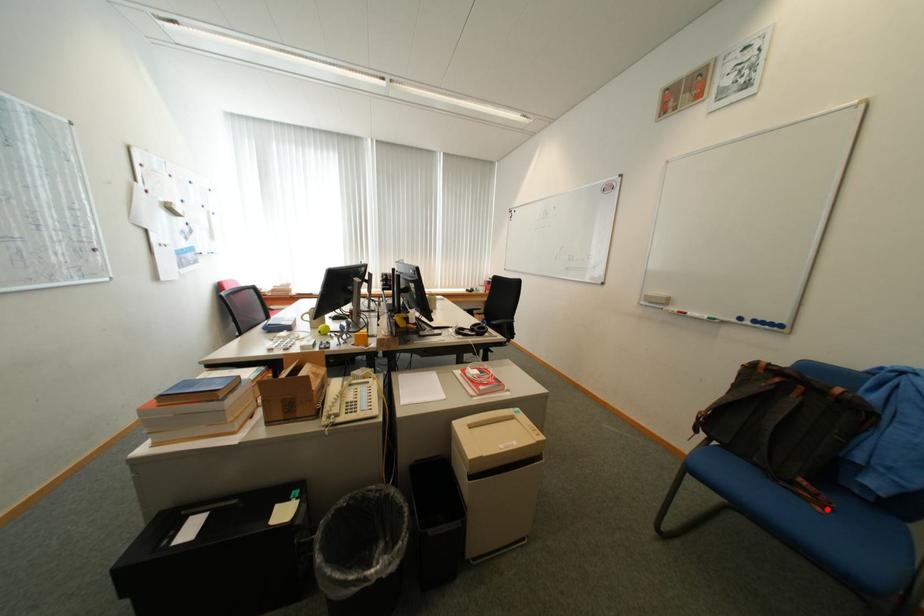
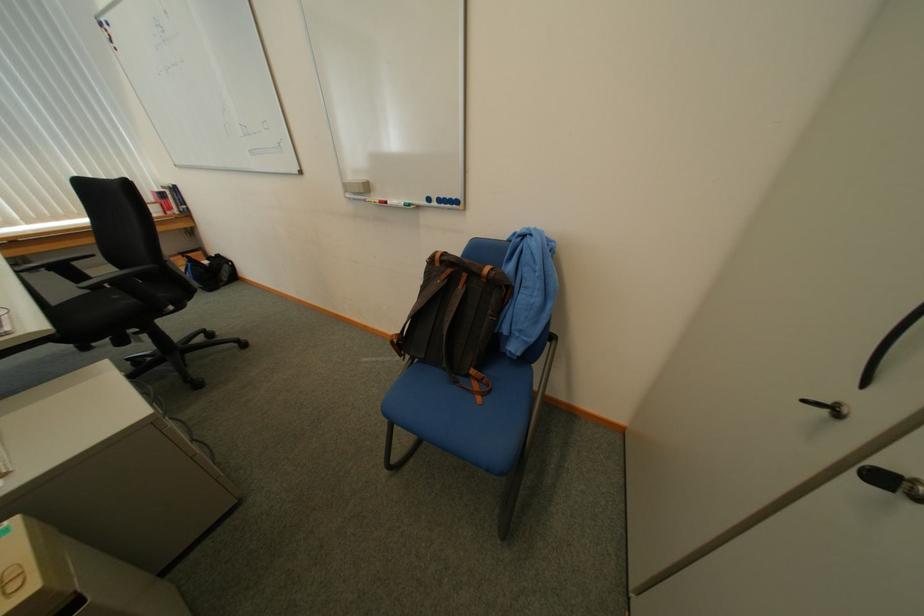
Question: I am providing you with two images of the same scene from different viewpoints. In image1, a red point is highlighted. Considering the same 3D point in image2, which of the following is correct?

Choices:
 (A) It is closer
 (B) It is farther

Answer: (B)